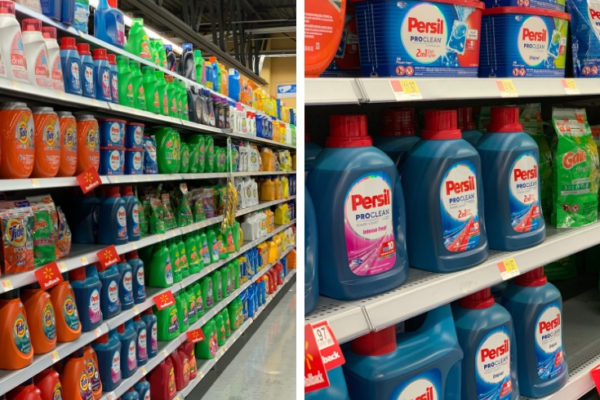
Where is `blue laundry detergent bottle`? This screenshot has width=600, height=400. blue laundry detergent bottle is located at coordinates (70, 75), (87, 77), (106, 81), (114, 85), (117, 222), (135, 212), (141, 272), (121, 280), (105, 293).